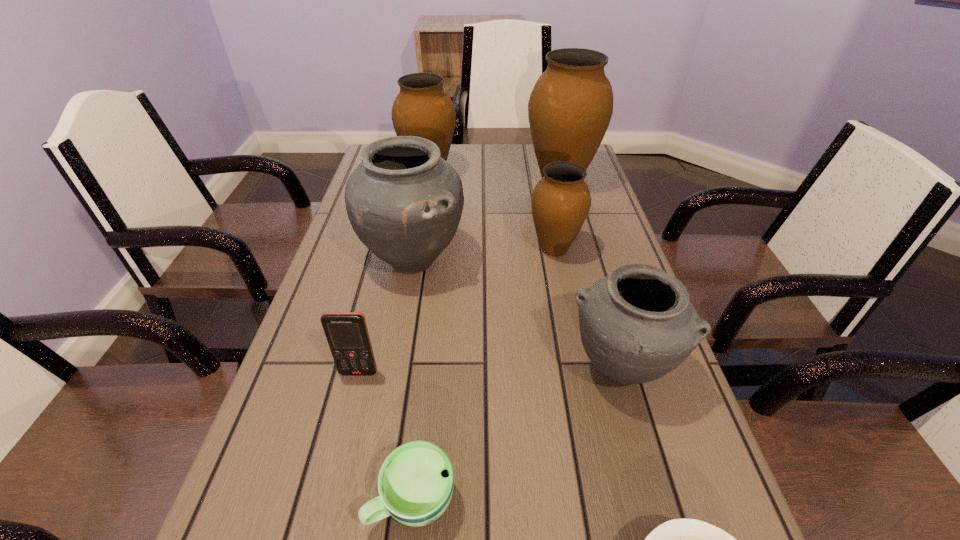
You are a GUI agent. You are given a task and a screenshot of the screen. Output one action in this format:
    pyautogui.click(x=<x>, y=<y>)
    Task: Click on the object at the far left corner
    
    Given the screenshot: What is the action you would take?
    pyautogui.click(x=422, y=108)

Where is `object that is at the far right corner`? The image size is (960, 540). object that is at the far right corner is located at coordinates (570, 107).

Find the location of a particular element. This screenshot has height=540, width=960. vacant space at the far edge of the desktop is located at coordinates (473, 176).

Find the location of `free point at the left edge`. free point at the left edge is located at coordinates (347, 401).

The width and height of the screenshot is (960, 540). Find the location of `vacant area at the right edge of the desktop`. vacant area at the right edge of the desktop is located at coordinates (576, 249).

Locate an element on the screen. The width and height of the screenshot is (960, 540). unoccupied position between the seventh tallest object and the cellular telephone is located at coordinates (386, 436).

Locate an element on the screen. The width and height of the screenshot is (960, 540). blank region between the bigger black urn and the blue cup is located at coordinates (413, 380).

You are a GUI agent. You are given a task and a screenshot of the screen. Output one action in this format:
    pyautogui.click(x=<x>, y=<y>)
    Task: Click on the free point between the farther black urn and the cellular telephone
    The height and width of the screenshot is (540, 960).
    Given the screenshot: What is the action you would take?
    pyautogui.click(x=386, y=316)

Identify the location of vacant area that lies between the blue cup and the cellular telephone. The width and height of the screenshot is (960, 540). (386, 436).

The image size is (960, 540). I want to click on unoccupied area between the seventh tallest object and the second biggest brown urn, so click(420, 337).